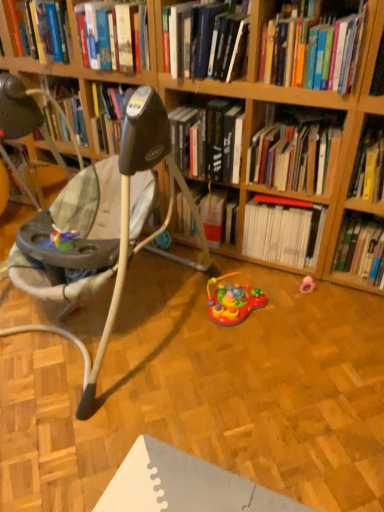
The height and width of the screenshot is (512, 384). Describe the element at coordinates (209, 140) in the screenshot. I see `hardcover book at upper center, which is the 3th book in left-to-right order` at that location.

Image resolution: width=384 pixels, height=512 pixels. Describe the element at coordinates (312, 51) in the screenshot. I see `hardcover books at upper center, positioned as the fourth book in left-to-right order` at that location.

Identify the location of hardcover book at center, the fourth book viewed from the right. (296, 152).

Image resolution: width=384 pixels, height=512 pixels. What do you see at coordinates (361, 249) in the screenshot?
I see `hardcover book at right, marked as the eighth book in a left-to-right arrangement` at bounding box center [361, 249].

Describe the element at coordinates (369, 166) in the screenshot. This screenshot has width=384, height=512. I see `yellow paper at upper right, which is the second book from right to left` at that location.

What are the coordinates of `hardcover book at upper center, which is the 3th book in left-to-right order` in the screenshot? It's located at (209, 140).

Considering the relative sizes of hardcover book at upper center, the 7th book positioned from the right, and hardcover book at upper center, acting as the 6th book starting from the right, in the image provided, is hardcover book at upper center, the 7th book positioned from the right, shorter than hardcover book at upper center, acting as the 6th book starting from the right,?

Yes, hardcover book at upper center, the 7th book positioned from the right, is shorter than hardcover book at upper center, acting as the 6th book starting from the right.

Is hardcover book at upper center, the 7th book positioned from the right, looking in the opposite direction of hardcover book at upper center, acting as the 6th book starting from the right?

No, hardcover book at upper center, acting as the 6th book starting from the right, is not at the back of hardcover book at upper center, the 7th book positioned from the right.

Considering their positions, is hardcover book at upper center, the 2th book from the left, located in front of or behind hardcover book at upper center, acting as the 6th book starting from the right?

In the image, hardcover book at upper center, the 2th book from the left, appears in front of hardcover book at upper center, acting as the 6th book starting from the right.

Which of these two, wooden bookshelf at upper center or hardcover books at upper center, positioned as the fourth book in left-to-right order, stands shorter?

Standing shorter between the two is wooden bookshelf at upper center.

From the picture: Measure the distance from wooden bookshelf at upper center to hardcover books at upper center, positioned as the 5th book in right-to-left order.

70.01 centimeters.

Based on their positions, is wooden bookshelf at upper center located to the left or right of hardcover books at upper center, positioned as the fourth book in left-to-right order?

Based on their positions, wooden bookshelf at upper center is located to the left of hardcover books at upper center, positioned as the fourth book in left-to-right order.

Which is correct: wooden bookshelf at upper center is inside hardcover books at upper center, positioned as the 5th book in right-to-left order, or outside of it?

wooden bookshelf at upper center is not enclosed by hardcover books at upper center, positioned as the 5th book in right-to-left order.

How much distance is there between hardcover book at upper center, the 8th book positioned from the right, and hardcover books at upper center, positioned as the 5th book in right-to-left order?

A distance of 24.52 inches exists between hardcover book at upper center, the 8th book positioned from the right, and hardcover books at upper center, positioned as the 5th book in right-to-left order.

From a real-world perspective, who is located higher, hardcover book at upper center, the 8th book positioned from the right, or hardcover books at upper center, positioned as the 5th book in right-to-left order?

hardcover books at upper center, positioned as the 5th book in right-to-left order, is physically above.

Considering the points (109, 62) and (313, 86), which point is in front, point (109, 62) or point (313, 86)?

The point (313, 86) is in front.

Is pink rubber pacifier at lower right, the second toy from the left, wider than hardcover book at upper center, acting as the 6th book starting from the right?

No.

Which is farther, (307, 285) or (196, 150)?

The point (307, 285) is farther from the camera.

From the image's perspective, would you say pink rubber pacifier at lower right, the second toy from the left, is shown under hardcover book at upper center, acting as the 6th book starting from the right?

Yes, from the image's perspective, pink rubber pacifier at lower right, the second toy from the left, is below hardcover book at upper center, acting as the 6th book starting from the right.

Is hardcover book at upper center, the 7th book positioned from the right, completely or partially outside of hardcover books at upper center, positioned as the fourth book in left-to-right order?

Yes, hardcover book at upper center, the 7th book positioned from the right, is outside of hardcover books at upper center, positioned as the fourth book in left-to-right order.

Measure the distance between hardcover book at upper center, the 7th book positioned from the right, and hardcover books at upper center, positioned as the 5th book in right-to-left order.

hardcover book at upper center, the 7th book positioned from the right, and hardcover books at upper center, positioned as the 5th book in right-to-left order, are 8.79 inches apart.

Which of these two, hardcover book at upper center, the 7th book positioned from the right, or hardcover books at upper center, positioned as the 5th book in right-to-left order, stands shorter?

With less height is hardcover book at upper center, the 7th book positioned from the right.

Can you tell me how much hardcover book at upper center, the 7th book positioned from the right, and hardcover books at upper center, positioned as the fourth book in left-to-right order, differ in facing direction?

There is a 0.000829-degree angle between the facing directions of hardcover book at upper center, the 7th book positioned from the right, and hardcover books at upper center, positioned as the fourth book in left-to-right order.

Is yellow paper at upper right, which is the 7th book from left to right, to the left of hardcover book at center, the fourth book viewed from the right, from the viewer's perspective?

→ In fact, yellow paper at upper right, which is the 7th book from left to right, is to the right of hardcover book at center, the fourth book viewed from the right.

Which is less distant, (x=368, y=163) or (x=280, y=137)?

Point (x=368, y=163) is positioned closer to the camera compared to point (x=280, y=137).

From a real-world perspective, is yellow paper at upper right, which is the second book from right to left, on top of hardcover book at center, which is counted as the fifth book, starting from the left?

No, from a real-world perspective, yellow paper at upper right, which is the second book from right to left, is not on top of hardcover book at center, which is counted as the fifth book, starting from the left.

Can you confirm if beige fabric baby swing at left is shorter than hardcover book at upper center, marked as the first book in a left-to-right arrangement?

Incorrect, the height of beige fabric baby swing at left does not fall short of that of hardcover book at upper center, marked as the first book in a left-to-right arrangement.

Which of these two, beige fabric baby swing at left or hardcover book at upper center, marked as the first book in a left-to-right arrangement, is smaller?

Result: hardcover book at upper center, marked as the first book in a left-to-right arrangement.

From the image's perspective, is beige fabric baby swing at left above or below hardcover book at upper center, marked as the first book in a left-to-right arrangement?

beige fabric baby swing at left is situated lower than hardcover book at upper center, marked as the first book in a left-to-right arrangement, in the image.

Which book is the 1st one when counting from the left side of the hardcover book at upper center, acting as the 6th book starting from the right? Please provide its 2D coordinates.

[(208, 40)]

The width and height of the screenshot is (384, 512). I want to click on the 4th book to the right of the wooden bookshelf at upper center, counting from the anchor's position, so click(312, 51).

Looking at the image, which one is located further to white matte bookshelf at center, which is the 6th book from left to right, hardcover book at center, which is counted as the fifth book, starting from the left, or hardcover books at upper center, positioned as the 5th book in right-to-left order?

The object further to white matte bookshelf at center, which is the 6th book from left to right, is hardcover books at upper center, positioned as the 5th book in right-to-left order.

Looking at the image, which one is located closer to white matte bookshelf at center, which is the 6th book from left to right, hardcover book at upper center, the 2th book from the left, or multicolored plastic toy at center, the 1th toy viewed from the left?

multicolored plastic toy at center, the 1th toy viewed from the left, is closer to white matte bookshelf at center, which is the 6th book from left to right.

Which object lies further to the anchor point hardcover book at right, acting as the 1th book starting from the right, multicolored plastic toy at center, the 1th toy viewed from the left, or beige fabric baby swing at left?

beige fabric baby swing at left is further to hardcover book at right, acting as the 1th book starting from the right.

From the image, which object appears to be nearer to hardcover book at upper center, which is the 3th book in left-to-right order, hardcover book at right, marked as the eighth book in a left-to-right arrangement, or hardcover book at upper center, the 8th book positioned from the right?

The object closer to hardcover book at upper center, which is the 3th book in left-to-right order, is hardcover book at upper center, the 8th book positioned from the right.

From the image, which object appears to be nearer to beige fabric baby swing at left, wooden bookshelf at upper center or hardcover book at upper center, the 2th book from the left?

hardcover book at upper center, the 2th book from the left, is positioned closer to the anchor beige fabric baby swing at left.

Estimate the real-world distances between objects in this image. Which object is closer to yellow paper at upper right, which is the second book from right to left, multicolored plastic toy at center, marked as the second toy in a right-to-left arrangement, or white matte bookshelf at center, the third book in the right-to-left sequence?

Based on the image, white matte bookshelf at center, the third book in the right-to-left sequence, appears to be nearer to yellow paper at upper right, which is the second book from right to left.

From the image, which object appears to be nearer to hardcover book at upper center, which is the 3th book in left-to-right order, pink rubber pacifier at lower right, the second toy from the left, or multicolored plastic toy at center, marked as the second toy in a right-to-left arrangement?

multicolored plastic toy at center, marked as the second toy in a right-to-left arrangement, lies closer to hardcover book at upper center, which is the 3th book in left-to-right order, than the other object.

Considering their positions, is hardcover books at upper center, positioned as the 5th book in right-to-left order, positioned closer to hardcover book at upper center, the 7th book positioned from the right, than hardcover book at right, acting as the 1th book starting from the right?

The object closer to hardcover book at upper center, the 7th book positioned from the right, is hardcover books at upper center, positioned as the 5th book in right-to-left order.

Where is `chair between hardcover book at upper center, marked as the first book in a left-to-right arrangement, and multicolored plastic toy at center, the 1th toy viewed from the left, from top to bottom`? Image resolution: width=384 pixels, height=512 pixels. chair between hardcover book at upper center, marked as the first book in a left-to-right arrangement, and multicolored plastic toy at center, the 1th toy viewed from the left, from top to bottom is located at coordinates (95, 223).

Where is `chair between hardcover book at upper center, marked as the first book in a left-to-right arrangement, and pink rubber pacifier at lower right, which is the first toy from right to left, in the vertical direction`? The image size is (384, 512). chair between hardcover book at upper center, marked as the first book in a left-to-right arrangement, and pink rubber pacifier at lower right, which is the first toy from right to left, in the vertical direction is located at coordinates (95, 223).

Locate an element on the screen. This screenshot has width=384, height=512. toy positioned between beige fabric baby swing at left and hardcover book at upper center, which is the 3th book in left-to-right order, from near to far is located at coordinates (232, 301).

Where is `toy that lies between white matte bookshelf at center, the third book in the right-to-left sequence, and multicolored plastic toy at center, marked as the second toy in a right-to-left arrangement, from top to bottom`? toy that lies between white matte bookshelf at center, the third book in the right-to-left sequence, and multicolored plastic toy at center, marked as the second toy in a right-to-left arrangement, from top to bottom is located at coordinates (307, 285).